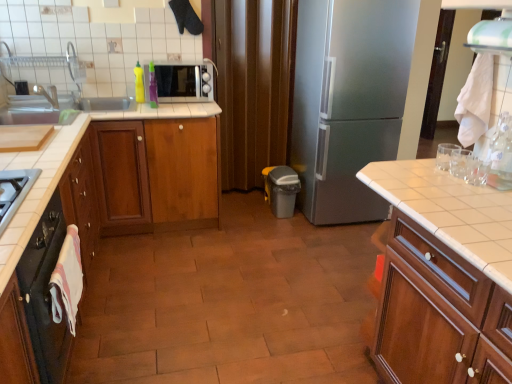
Question: Considering the relative sizes of wooden cabinet at center, acting as the 2th cabinetry starting from the right, and clear plastic bottle at right, placed as the third bottle when sorted from left to right, in the image provided, is wooden cabinet at center, acting as the 2th cabinetry starting from the right, smaller than clear plastic bottle at right, placed as the third bottle when sorted from left to right,?

Choices:
 (A) no
 (B) yes

Answer: (A)

Question: Does wooden cabinet at center, the third cabinetry viewed from the left, lie behind clear plastic bottle at right, which appears as the third bottle when viewed from the back?

Choices:
 (A) no
 (B) yes

Answer: (B)

Question: Is wooden cabinet at center, acting as the 2th cabinetry starting from the right, facing away from clear plastic bottle at right, which ranks as the 1th bottle in front-to-back order?

Choices:
 (A) yes
 (B) no

Answer: (B)

Question: Is the depth of wooden cabinet at center, the third cabinetry viewed from the left, less than that of clear plastic bottle at right, the third bottle when ordered from top to bottom?

Choices:
 (A) yes
 (B) no

Answer: (B)

Question: Is wooden cabinet at center, acting as the 2th cabinetry starting from the right, taller than clear plastic bottle at right, the first bottle when ordered from bottom to top?

Choices:
 (A) yes
 (B) no

Answer: (A)

Question: Considering the relative positions of wooden cabinet at center, acting as the 2th cabinetry starting from the right, and wooden cabinet at center, the third cabinetry in the right-to-left sequence, in the image provided, is wooden cabinet at center, acting as the 2th cabinetry starting from the right, to the left or to the right of wooden cabinet at center, the third cabinetry in the right-to-left sequence,?

Choices:
 (A) left
 (B) right

Answer: (B)

Question: Looking at their shapes, would you say wooden cabinet at center, acting as the 2th cabinetry starting from the right, is wider or thinner than wooden cabinet at center, the third cabinetry in the right-to-left sequence?

Choices:
 (A) thin
 (B) wide

Answer: (A)

Question: Is point (172, 221) closer or farther from the camera than point (0, 304)?

Choices:
 (A) closer
 (B) farther

Answer: (B)

Question: Is wooden cabinet at center, acting as the 2th cabinetry starting from the right, taller or shorter than wooden cabinet at center, the third cabinetry in the right-to-left sequence?

Choices:
 (A) short
 (B) tall

Answer: (B)

Question: Choose the correct answer: Is wooden cabinet at right, which ranks as the 1th cabinetry in right-to-left order, inside white tile countertop at right or outside it?

Choices:
 (A) outside
 (B) inside

Answer: (A)

Question: Relative to white tile countertop at right, is wooden cabinet at right, which ranks as the 1th cabinetry in right-to-left order, in front or behind?

Choices:
 (A) behind
 (B) front

Answer: (B)

Question: Looking at the image, does wooden cabinet at right, which ranks as the 1th cabinetry in right-to-left order, seem bigger or smaller compared to white tile countertop at right?

Choices:
 (A) small
 (B) big

Answer: (B)

Question: Considering the positions of point (400, 352) and point (477, 254), is point (400, 352) closer or farther from the camera than point (477, 254)?

Choices:
 (A) farther
 (B) closer

Answer: (A)

Question: Considering their positions, is green plastic bottle at upper left, the 2th bottle when ordered from front to back, located in front of or behind white glossy exhaust hood at upper right?

Choices:
 (A) behind
 (B) front

Answer: (A)

Question: Choose the correct answer: Is green plastic bottle at upper left, which ranks as the second bottle in bottom-to-top order, inside white glossy exhaust hood at upper right or outside it?

Choices:
 (A) inside
 (B) outside

Answer: (B)